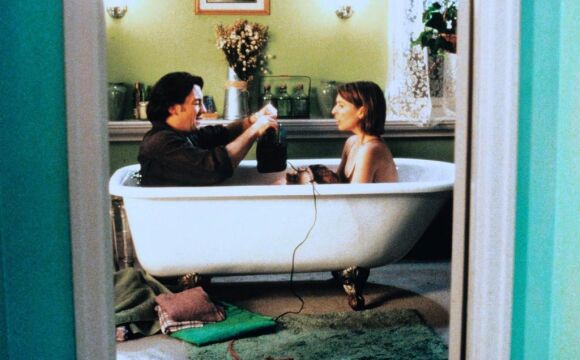
Locate an element on the screen. Image resolution: width=580 pixels, height=360 pixels. power cord is located at coordinates (296, 246).